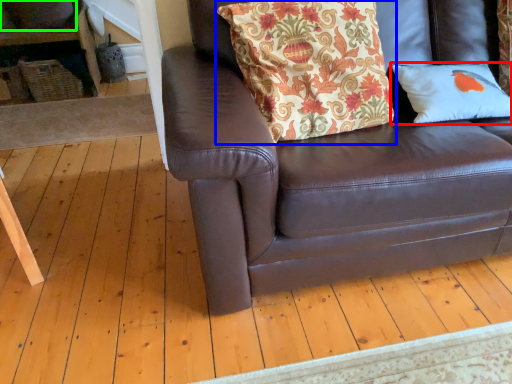
Question: Which object is positioned farthest from pillow (highlighted by a red box)? Select from pillow (highlighted by a blue box) and gray (highlighted by a green box).

Choices:
 (A) pillow
 (B) gray

Answer: (B)